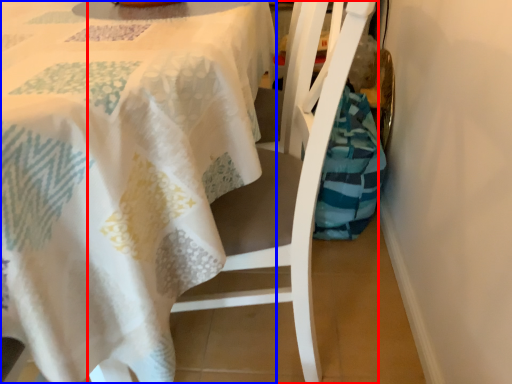
Question: Among these objects, which one is nearest to the camera, chair (highlighted by a red box) or tablecloth (highlighted by a blue box)?

Choices:
 (A) chair
 (B) tablecloth

Answer: (B)